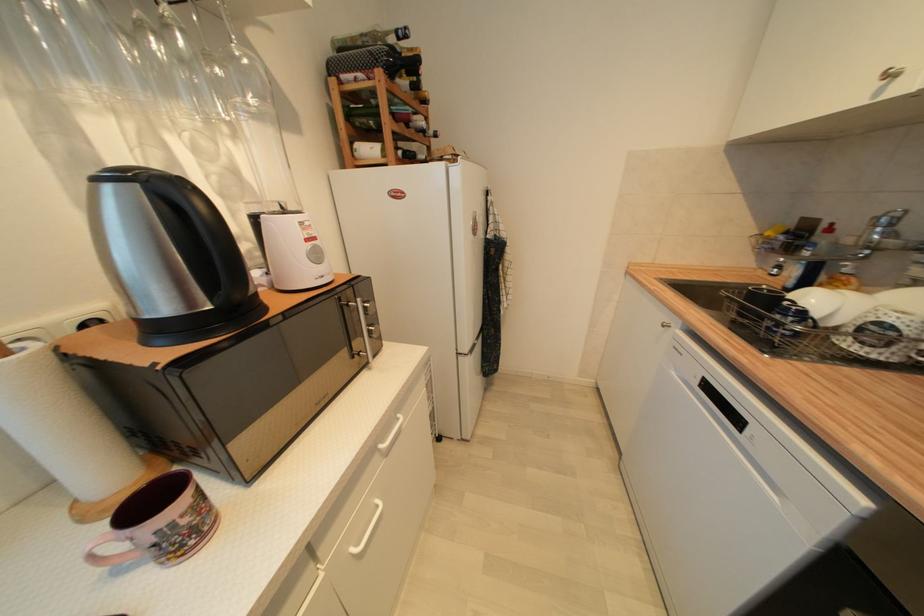
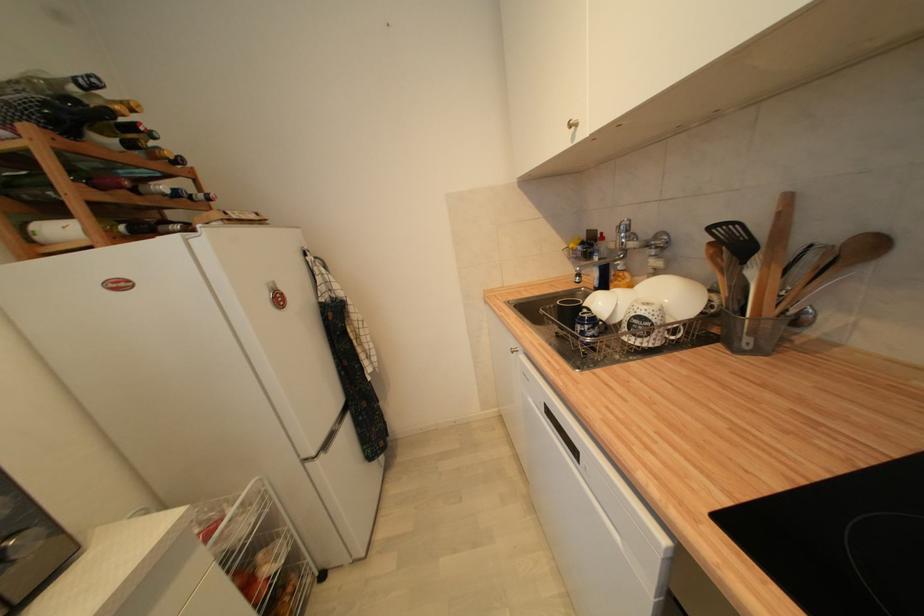
Locate, in the second image, the point that corresponds to pixel 744 423 in the first image.

(578, 453)